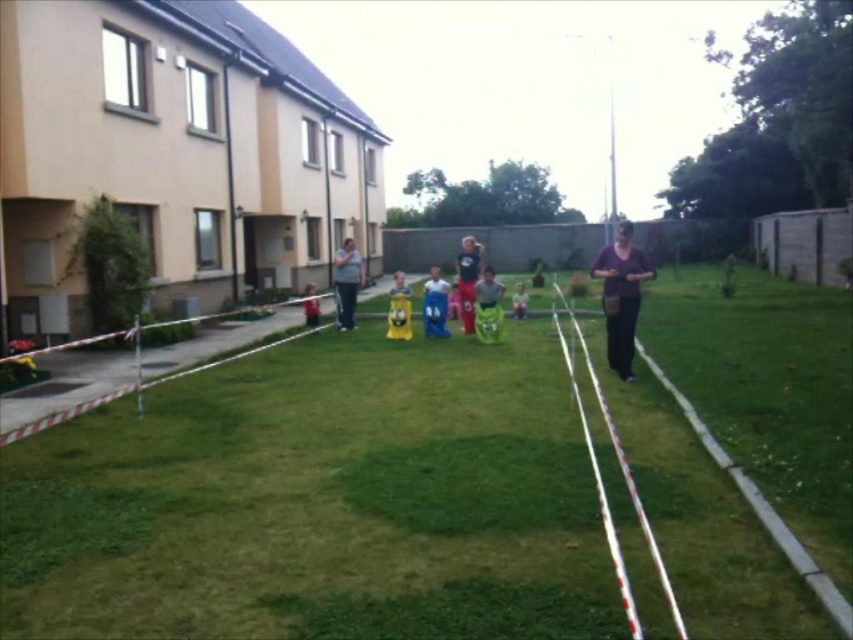
You are a photographer standing at the starting line of the sack race. You want to take a photo of both the yellow fabric at center and the matte gray shirt at center. Which object should you adjust your camera focus on first to ensure both are in the frame?

The matte gray shirt at center is behind the yellow fabric at center, so you should focus on the matte gray shirt at center first to ensure both are in the frame.

You are a photographer standing at the starting line of the sack race. You want to take a photo of the green grass at center and the white plastic tape at center. Which object is closer to your camera lens?

The white plastic tape at center is closer to the camera lens because the green grass at center is further away.

You are standing at the starting line of the sack race and looking towards the building. There are two points marked on the ground in front of you. One is at point coordinates point (390, 296) and the other is at point coordinates point (479, 288). Which point is closer to you?

The point at coordinates point (390, 296) is closer to you because it is further to the camera than point (479, 288).